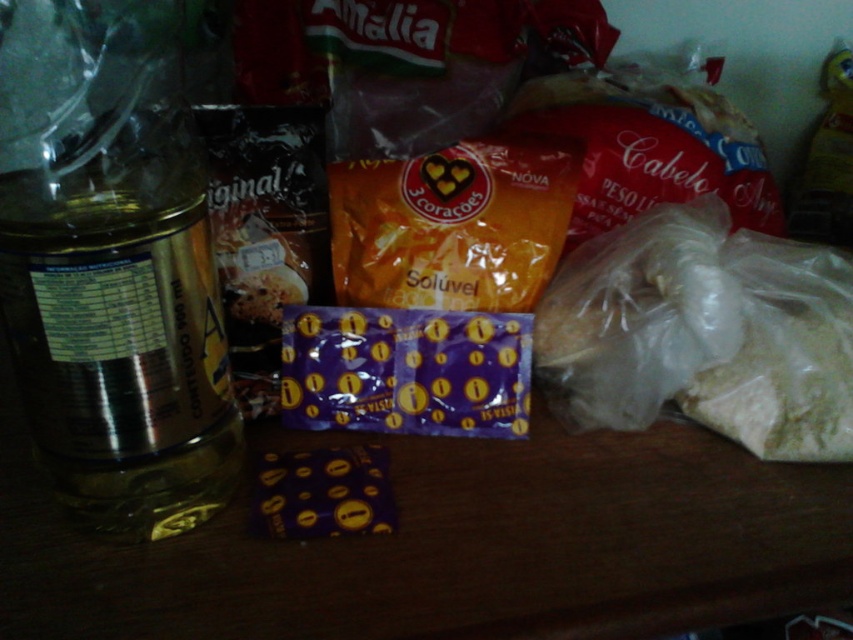
Question: Can you confirm if white powder at right is smaller than orange matte packet at center?

Choices:
 (A) no
 (B) yes

Answer: (A)

Question: Which object is closer to the camera taking this photo?

Choices:
 (A) white powder at right
 (B) orange matte packet at center

Answer: (A)

Question: Does metallic gold bottle at left appear over orange matte packet at center?

Choices:
 (A) yes
 (B) no

Answer: (B)

Question: Estimate the real-world distances between objects in this image. Which object is farther from the orange matte packet at center?

Choices:
 (A) metallic gold bottle at left
 (B) white powder at right

Answer: (A)

Question: Is white powder at right further to camera compared to orange matte packet at center?

Choices:
 (A) no
 (B) yes

Answer: (A)

Question: Which point is farther from the camera taking this photo?

Choices:
 (A) (173, 83)
 (B) (769, 381)

Answer: (B)